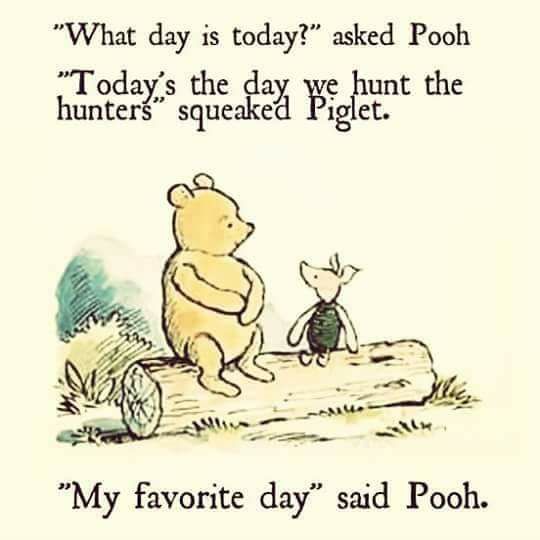
This screenshot has height=540, width=540. What are the coordinates of `the chest` in the screenshot? It's located at (224, 278).